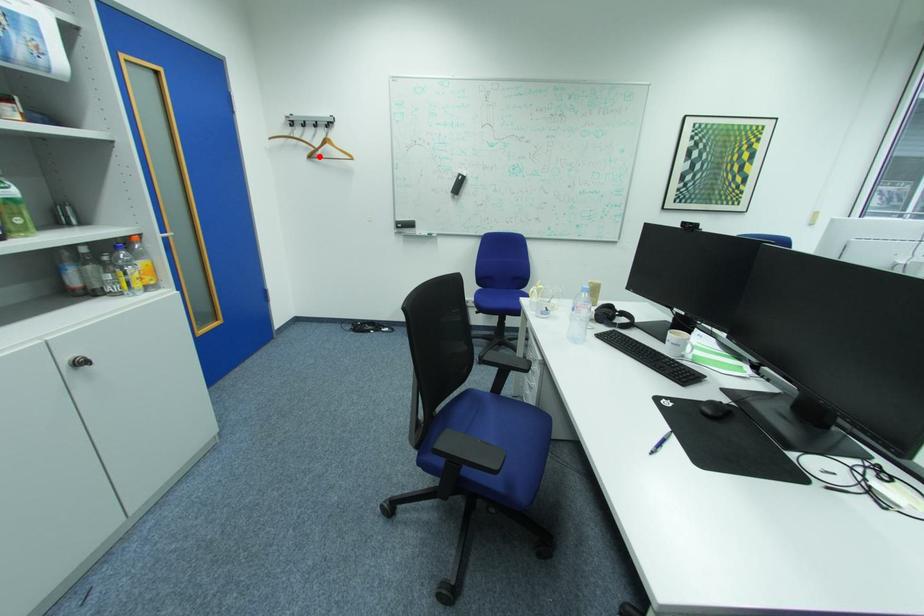
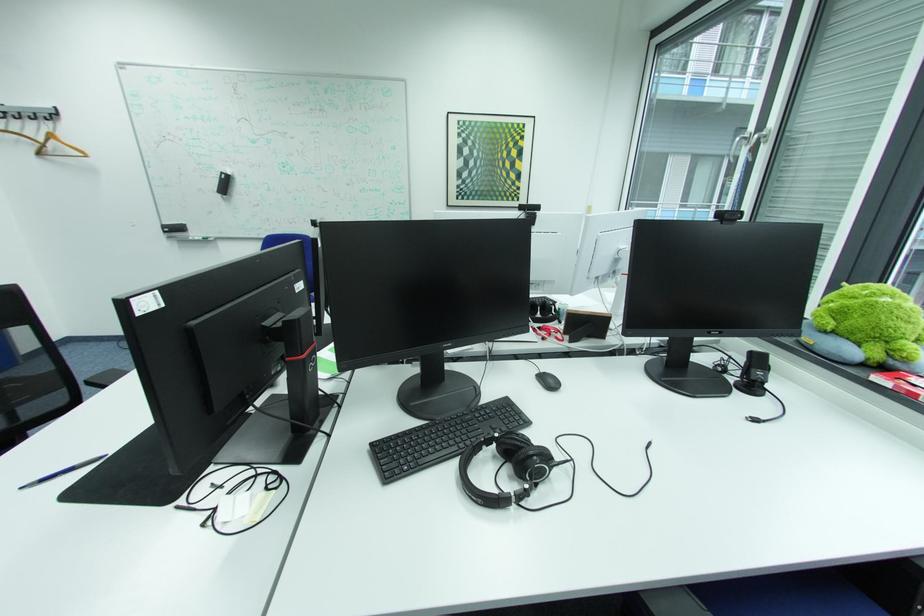
Question: A red point is marked in image1. In image2, is the corresponding 3D point closer to the camera or farther? Reply with the corresponding letter.

Choices:
 (A) The corresponding 3D point is closer.
 (B) The corresponding 3D point is farther.

Answer: (B)